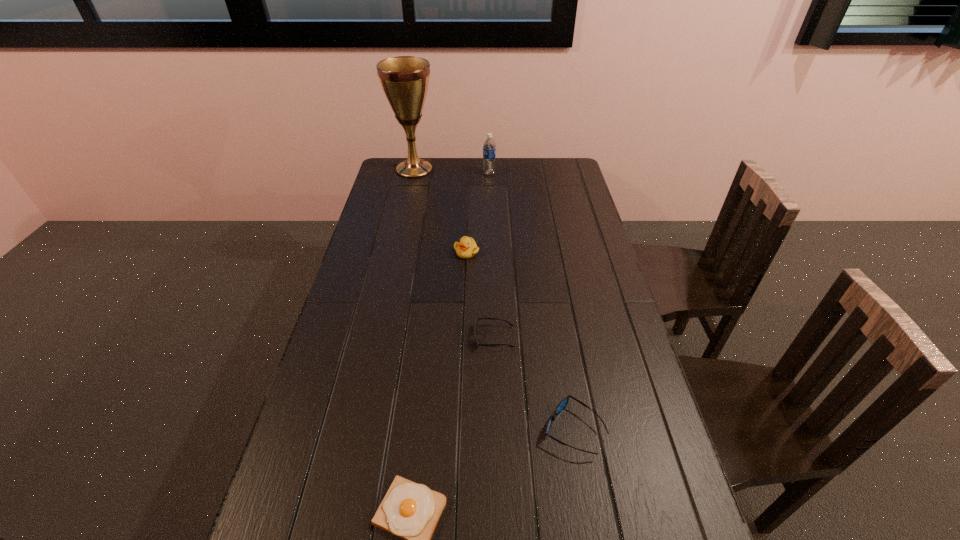
Identify the location of the tallest object. Image resolution: width=960 pixels, height=540 pixels. (405, 79).

Locate an element on the screen. The image size is (960, 540). water bottle is located at coordinates (489, 147).

Identify the location of duckling. (466, 248).

Identify the location of the fourth nearest object. This screenshot has width=960, height=540. (466, 248).

This screenshot has height=540, width=960. I want to click on the rightmost object, so click(564, 402).

Find the location of a particular element. The width and height of the screenshot is (960, 540). the nearer sunglasses is located at coordinates (564, 402).

Identify the location of the farther sunglasses. (476, 323).

Locate an element on the screen. Image resolution: width=960 pixels, height=540 pixels. the shorter sunglasses is located at coordinates (476, 323).

Identify the location of free space located 0.290m on the right of the tallest object. This screenshot has width=960, height=540. pos(500,170).

You are a GUI agent. You are given a task and a screenshot of the screen. Output one action in this format:
    pyautogui.click(x=<x>, y=<y>)
    Task: Click on the free spot located on the front of the second tallest object
    
    Given the screenshot: What is the action you would take?
    pyautogui.click(x=490, y=206)